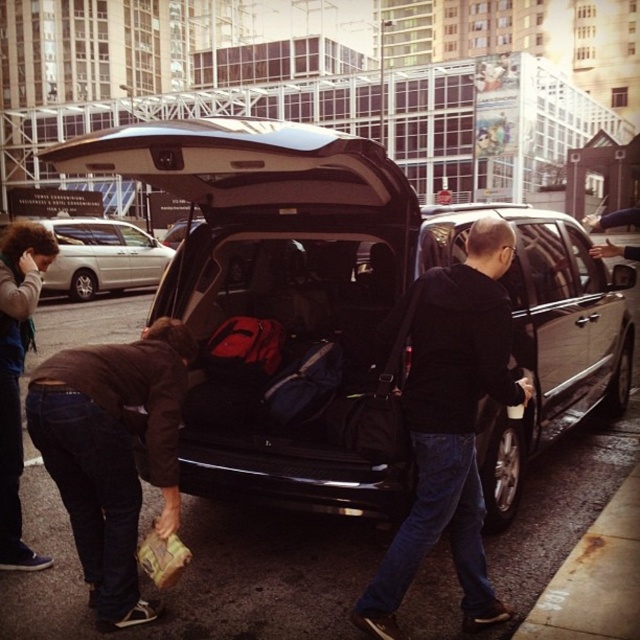
You are a delivery person who needs to load a package into the trunk of the silver metallic van at center. The black leather jacket at center is blocking the trunk. Can you move the jacket to the left to access the trunk?

The black leather jacket at center is positioned on the right side of the silver metallic van at center, so moving it to the left would allow access to the trunk.